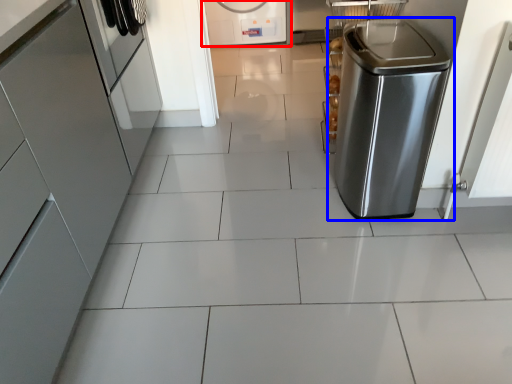
Question: Which of the following is the farthest to the observer, home appliance (highlighted by a red box) or home appliance (highlighted by a blue box)?

Choices:
 (A) home appliance
 (B) home appliance

Answer: (A)